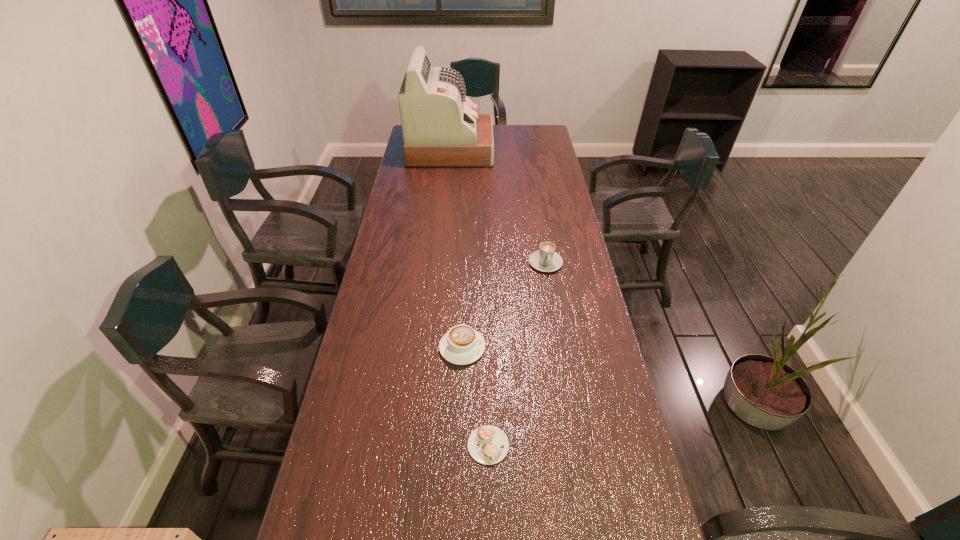
Find the location of a particular element. cappuccino that is the second closest to the second tallest object is located at coordinates (487, 444).

Locate an element on the screen. This screenshot has width=960, height=540. cappuccino that is the closest to the second farthest cappuccino is located at coordinates (487, 444).

Image resolution: width=960 pixels, height=540 pixels. Find the location of `vacant space that satisfies the following two spatial constraints: 1. on the back side of the shortest cappuccino; 2. on the operating side of the cash register`. vacant space that satisfies the following two spatial constraints: 1. on the back side of the shortest cappuccino; 2. on the operating side of the cash register is located at coordinates (484, 151).

Find the location of a particular element. free space in the image that satisfies the following two spatial constraints: 1. with the handle on the right side of the shortest object; 2. on the left side of the second shortest object is located at coordinates (459, 445).

You are a GUI agent. You are given a task and a screenshot of the screen. Output one action in this format:
    pyautogui.click(x=<x>, y=<y>)
    Task: Click on the vacant space that satisfies the following two spatial constraints: 1. on the operating side of the nearest cappuccino; 2. on the left side of the farthest object
    This screenshot has width=960, height=540.
    Given the screenshot: What is the action you would take?
    pyautogui.click(x=420, y=445)

What are the coordinates of `free point that satisfies the following two spatial constraints: 1. on the operating side of the nearest object; 2. on the right side of the tallest object` in the screenshot? It's located at (420, 445).

Where is `free space that satisfies the following two spatial constraints: 1. with the handle on the right side of the second nearest object; 2. on the back side of the nearest cappuccino`? This screenshot has width=960, height=540. free space that satisfies the following two spatial constraints: 1. with the handle on the right side of the second nearest object; 2. on the back side of the nearest cappuccino is located at coordinates (459, 445).

Where is `free space that satisfies the following two spatial constraints: 1. on the operating side of the shortest cappuccino; 2. on the left side of the cash register`? Image resolution: width=960 pixels, height=540 pixels. free space that satisfies the following two spatial constraints: 1. on the operating side of the shortest cappuccino; 2. on the left side of the cash register is located at coordinates (420, 445).

The image size is (960, 540). Find the location of `vacant region that satisfies the following two spatial constraints: 1. with the handle on the right side of the second tallest cappuccino; 2. on the back side of the nearest cappuccino`. vacant region that satisfies the following two spatial constraints: 1. with the handle on the right side of the second tallest cappuccino; 2. on the back side of the nearest cappuccino is located at coordinates (459, 445).